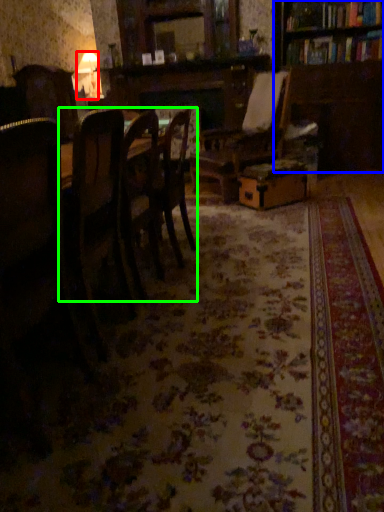
Question: Estimate the real-world distances between objects in this image. Which object is farther from lamp (highlighted by a red box), bookcase (highlighted by a blue box) or kitchen & dining room table (highlighted by a green box)?

Choices:
 (A) bookcase
 (B) kitchen & dining room table

Answer: (B)